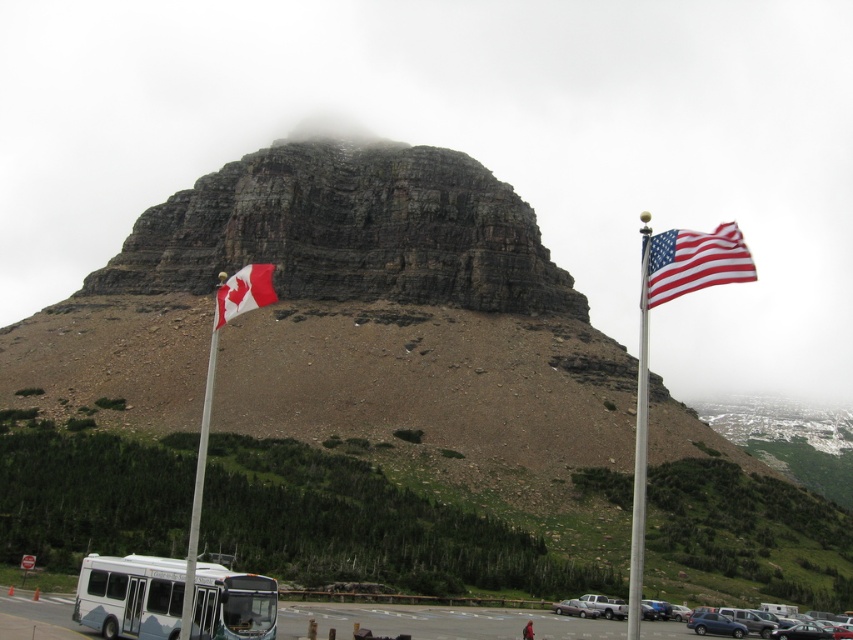
Does point (645, 371) lie behind point (753, 632)?

Yes.

The height and width of the screenshot is (640, 853). I want to click on polished metal flagpole at right, so click(x=639, y=448).

Can you confirm if white matte bus at lower left is shorter than metallic silver sedan at lower right?

No, white matte bus at lower left is not shorter than metallic silver sedan at lower right.

Is point (160, 625) in front of point (738, 614)?

Yes, point (160, 625) is in front of point (738, 614).

The height and width of the screenshot is (640, 853). What do you see at coordinates (131, 595) in the screenshot?
I see `white matte bus at lower left` at bounding box center [131, 595].

Where is `white matte bus at lower left`? white matte bus at lower left is located at coordinates (131, 595).

Is point (711, 259) less distant than point (186, 627)?

No, it is not.

Who is higher up, red-white striped fabric flag at right or white plastic flag pole at left?

red-white striped fabric flag at right is above.

Is point (730, 246) closer to camera compared to point (189, 548)?

Yes.

Where is `red-white striped fabric flag at right`? red-white striped fabric flag at right is located at coordinates (695, 260).